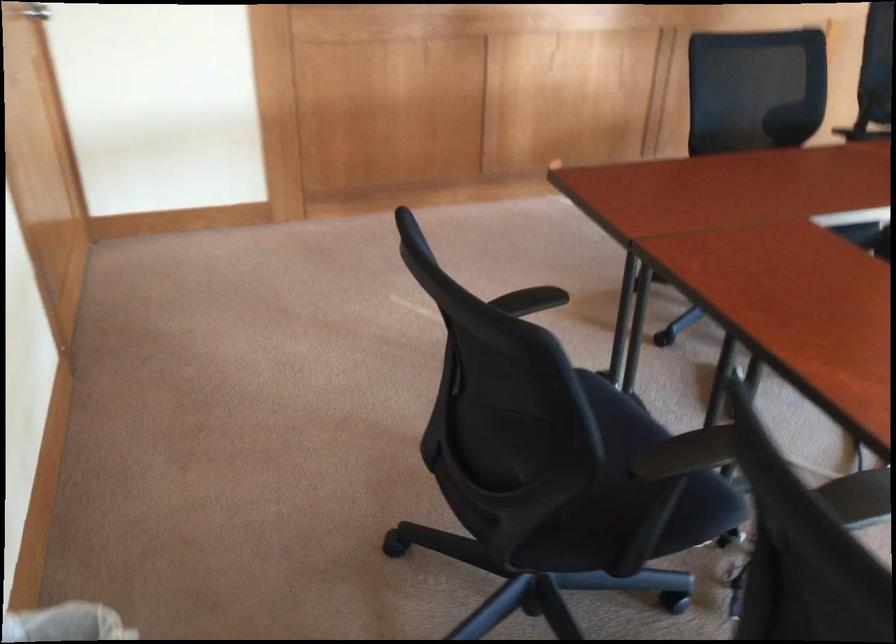
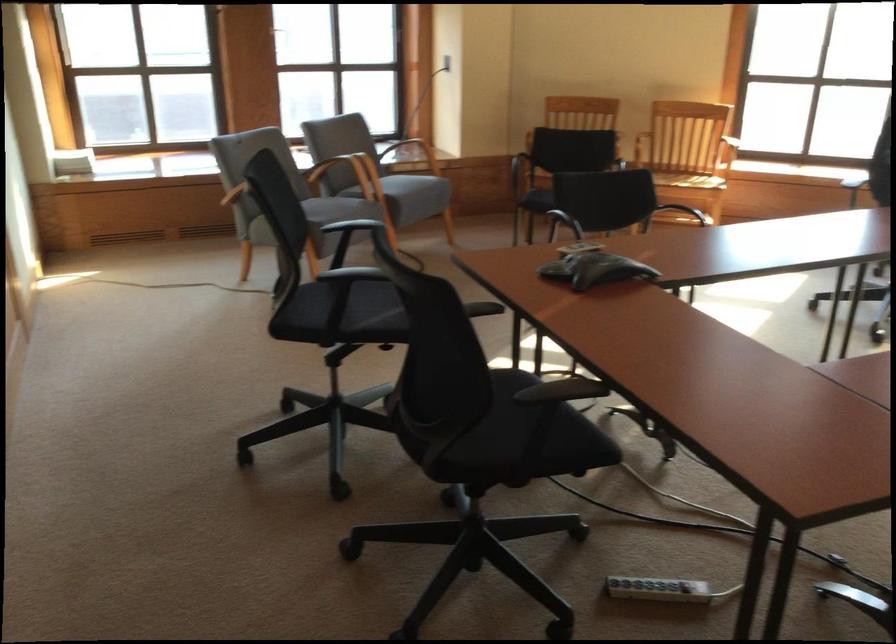
Where in the second image is the point corresponding to pixel 698 146 from the first image?

(561, 391)